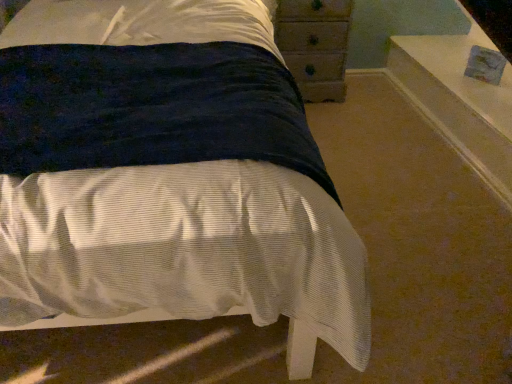
Question: Could you tell me if white glossy window sill at upper right is facing wooden chest of drawers at upper right?

Choices:
 (A) no
 (B) yes

Answer: (B)

Question: Is white glossy window sill at upper right smaller than wooden chest of drawers at upper right?

Choices:
 (A) yes
 (B) no

Answer: (B)

Question: From a real-world perspective, is white glossy window sill at upper right under wooden chest of drawers at upper right?

Choices:
 (A) yes
 (B) no

Answer: (A)

Question: Is white glossy window sill at upper right further to camera compared to wooden chest of drawers at upper right?

Choices:
 (A) yes
 (B) no

Answer: (B)

Question: Is white glossy window sill at upper right oriented away from wooden chest of drawers at upper right?

Choices:
 (A) yes
 (B) no

Answer: (B)

Question: Is white glossy window sill at upper right outside wooden chest of drawers at upper right?

Choices:
 (A) yes
 (B) no

Answer: (A)

Question: Is wooden chest of drawers at upper right smaller than velvet dark blue bed at center?

Choices:
 (A) yes
 (B) no

Answer: (A)

Question: Is wooden chest of drawers at upper right oriented towards velvet dark blue bed at center?

Choices:
 (A) no
 (B) yes

Answer: (B)

Question: Is wooden chest of drawers at upper right to the left of velvet dark blue bed at center from the viewer's perspective?

Choices:
 (A) no
 (B) yes

Answer: (A)

Question: Is wooden chest of drawers at upper right oriented away from velvet dark blue bed at center?

Choices:
 (A) no
 (B) yes

Answer: (A)

Question: Is wooden chest of drawers at upper right not near velvet dark blue bed at center?

Choices:
 (A) no
 (B) yes

Answer: (B)

Question: Is wooden chest of drawers at upper right bigger than velvet dark blue bed at center?

Choices:
 (A) yes
 (B) no

Answer: (B)

Question: Is the surface of velvet dark blue bed at center in direct contact with wooden chest of drawers at upper right?

Choices:
 (A) yes
 (B) no

Answer: (B)